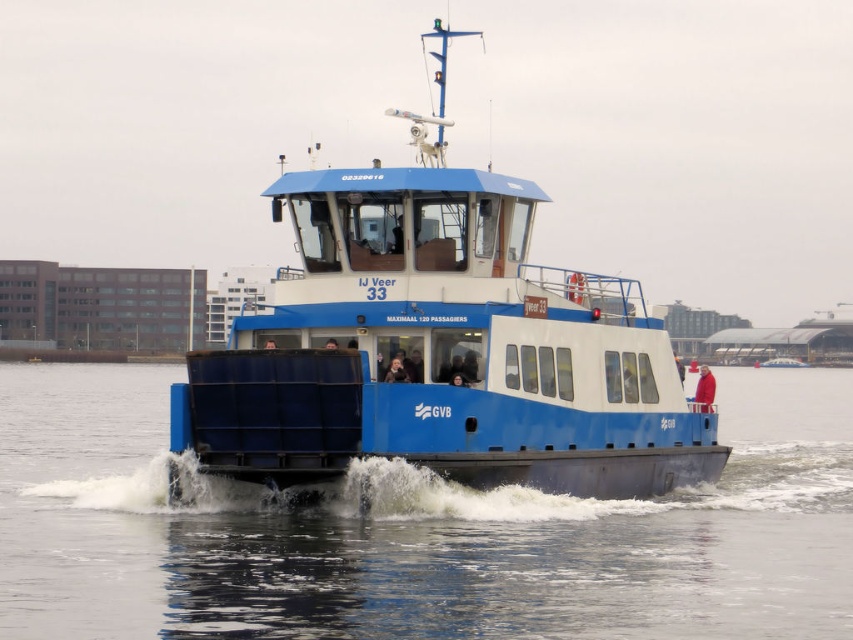
You are standing on the deck of the ferry IJ Veer 33 and see the blue metallic water at center and the red woolen sweater at center. Which object is nearer to you?

The blue metallic water at center is closer to you than the red woolen sweater at center.

You are a passenger on the ferry and want to take a photo of the red woolen sweater at center without moving from your current position. Is the blue matte ferry at center blocking your view of the sweater?

The blue matte ferry at center is positioned on the left side of the red woolen sweater at center, so it is blocking the view of the sweater if you are on the ferry and cannot move.

You are a passenger on the ferry IJ Veer 33 and you see the blue metallic water at center and the red woolen sweater at center. Which object is closer to the deck of the ferry?

The red woolen sweater at center is closer to the deck of the ferry because it is positioned above the blue metallic water at center, which is under it.